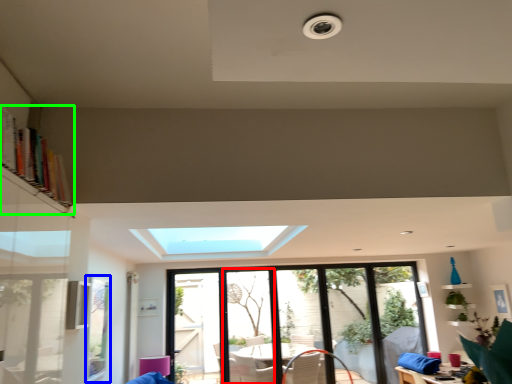
Question: Which object is positioned farthest from screen door (highlighted by a red box)? Select from window screen (highlighted by a blue box) and bookshelf (highlighted by a green box).

Choices:
 (A) window screen
 (B) bookshelf

Answer: (B)